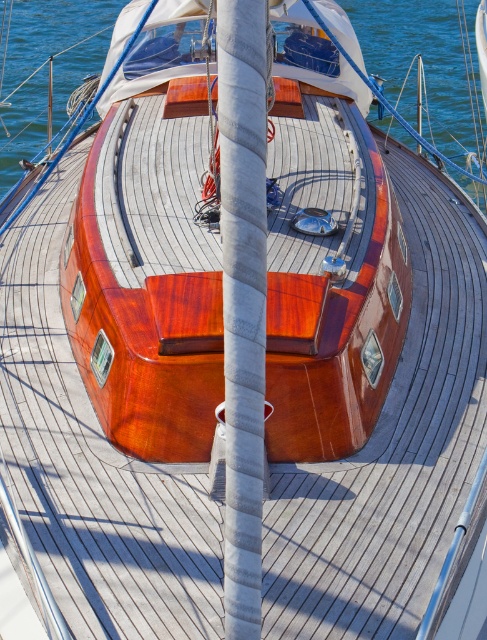
Is point (236, 186) more distant than point (78, 13)?

No.

Which is in front, point (228, 592) or point (390, 84)?

Point (228, 592) is in front.

Image resolution: width=487 pixels, height=640 pixels. What are the coordinates of `white textured mast at center` in the screenshot? It's located at (243, 298).